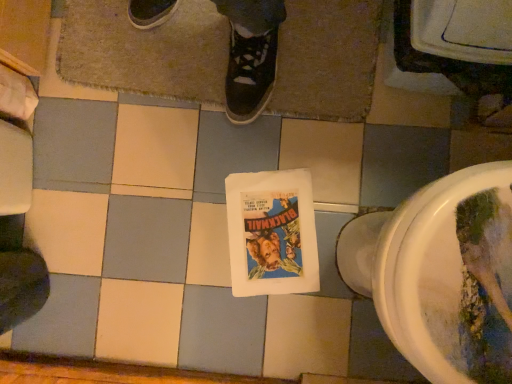
The image size is (512, 384). Identify the location of free point behind matte paper comic book at center. (212, 165).